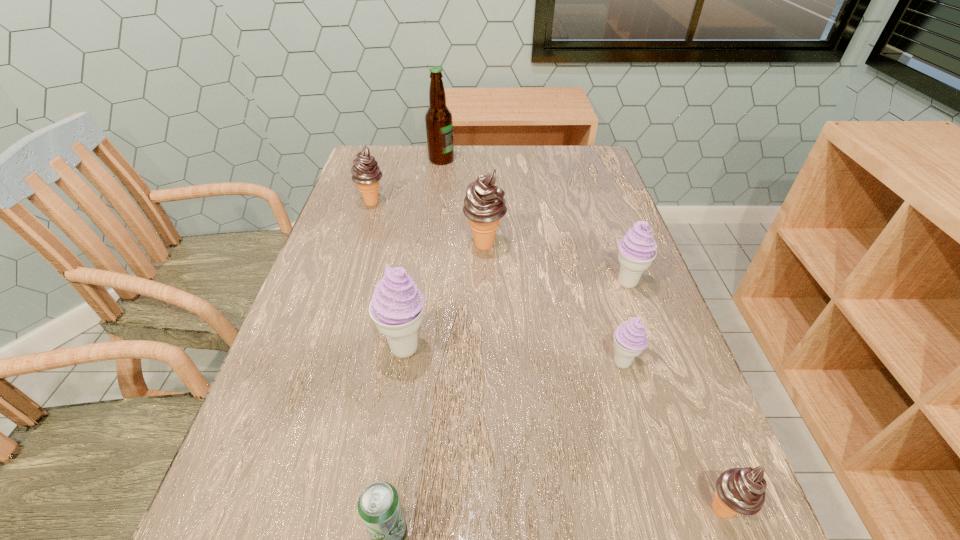
You are a GUI agent. You are given a task and a screenshot of the screen. Output one action in this format:
    pyautogui.click(x=<x>, y=<y>)
    Task: Click on the brown beer bottle
    
    Given the screenshot: What is the action you would take?
    pyautogui.click(x=439, y=124)

Locate an element on the screen. the tallest object is located at coordinates (439, 124).

The image size is (960, 540). I want to click on the second nearest chocolate icecream, so click(484, 205).

Where is `the second chocolate icecream from left to right`? This screenshot has width=960, height=540. the second chocolate icecream from left to right is located at coordinates (484, 205).

At what (x,y) coordinates should I click in order to perform the action: click on the leftmost purple icecream. Please return your answer as a coordinate pair (x, y). Looking at the image, I should click on click(x=397, y=305).

Image resolution: width=960 pixels, height=540 pixels. Identify the location of the biggest purple icecream. (397, 305).

At what (x,y) coordinates should I click in order to perform the action: click on the second farthest object. Please return your answer as a coordinate pair (x, y). This screenshot has width=960, height=540. Looking at the image, I should click on (366, 173).

Where is `the second smallest chocolate icecream`? Image resolution: width=960 pixels, height=540 pixels. the second smallest chocolate icecream is located at coordinates (366, 173).

This screenshot has width=960, height=540. In order to click on the fourth nearest icecream in this screenshot , I will do `click(637, 249)`.

Image resolution: width=960 pixels, height=540 pixels. In order to click on the fifth nearest object in this screenshot , I will do `click(637, 249)`.